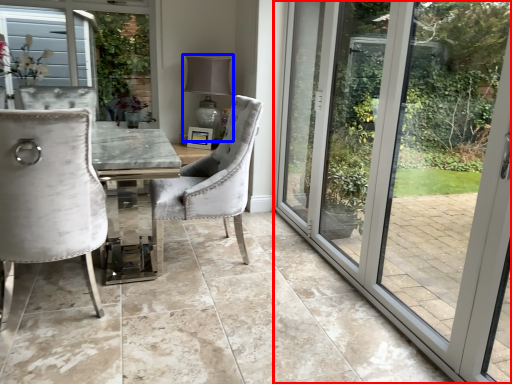
Question: Which point is closer to the camera, door (highlighted by a red box) or lamp (highlighted by a blue box)?

Choices:
 (A) door
 (B) lamp

Answer: (A)